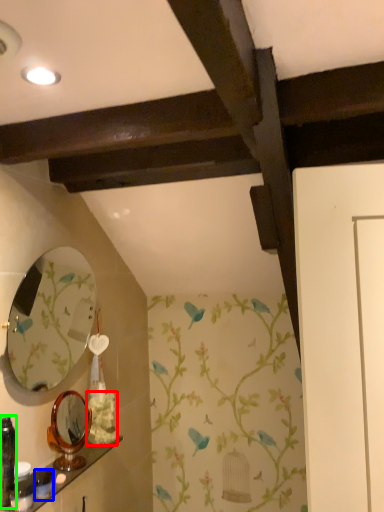
Question: Based on their relative distances, which object is nearer to flower (highlighted by a red box)? Choose from toiletry (highlighted by a blue box) and toiletry (highlighted by a green box).

Choices:
 (A) toiletry
 (B) toiletry

Answer: (A)